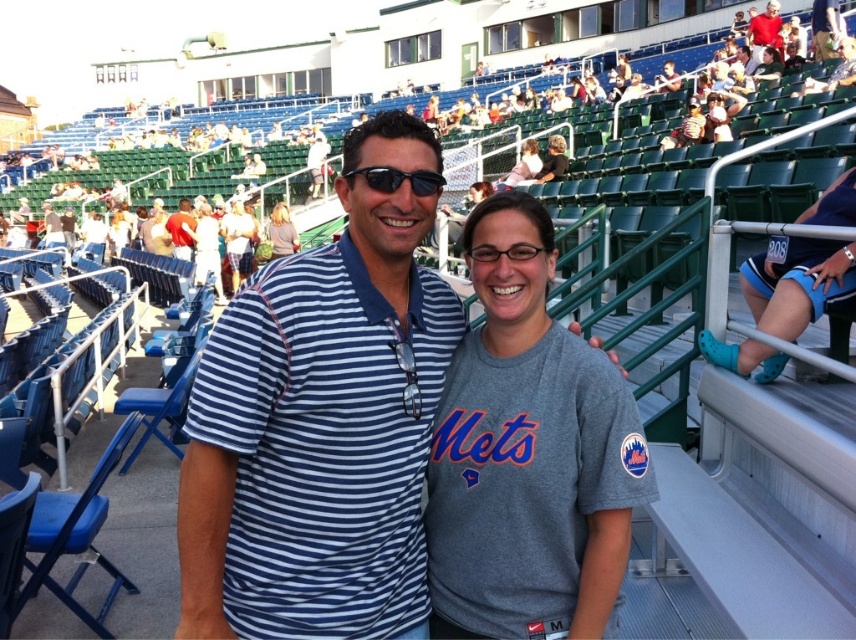
Question: Observing the image, what is the correct spatial positioning of blonde hair at upper center in reference to pink fabric at upper center?

Choices:
 (A) left
 (B) right

Answer: (A)

Question: Which of the following is the farthest from the observer?

Choices:
 (A) red shirt at upper right
 (B) matte gray shirt at center
 (C) black plastic sunglasses at center
 (D) blonde hair at upper center

Answer: (B)

Question: Can you confirm if white cotton shirt at center is wider than matte black sunglasses at upper center?

Choices:
 (A) no
 (B) yes

Answer: (A)

Question: Which object appears farthest from the camera in this image?

Choices:
 (A) black plastic sunglasses at center
 (B) matte gray shirt at center
 (C) black plastic glasses at center

Answer: (B)

Question: Can you confirm if blonde hair at upper center is positioned to the right of reddish-brown leather jacket at center?

Choices:
 (A) no
 (B) yes

Answer: (B)

Question: Which point appears closest to the camera in this image?

Choices:
 (A) (616, 512)
 (B) (541, 179)
 (C) (177, 225)

Answer: (A)